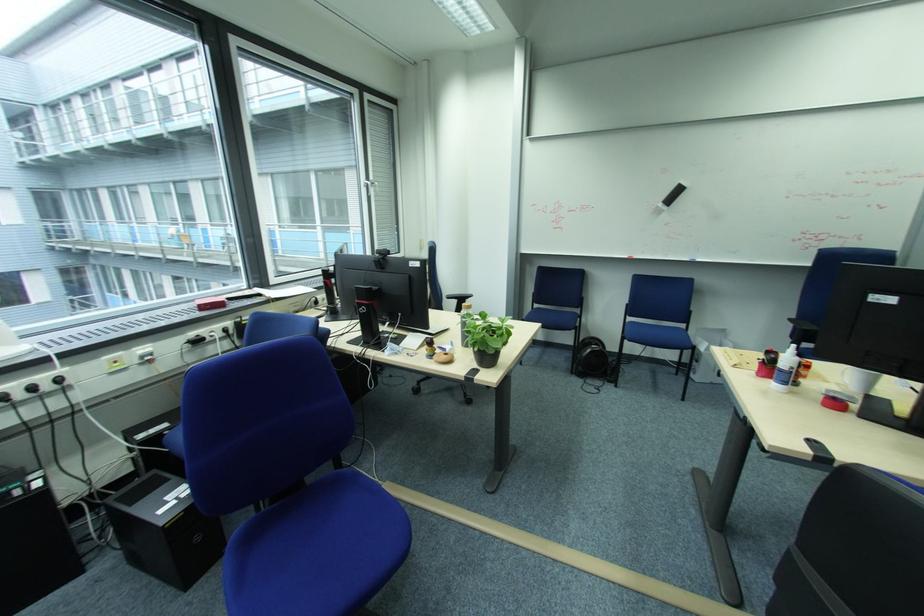
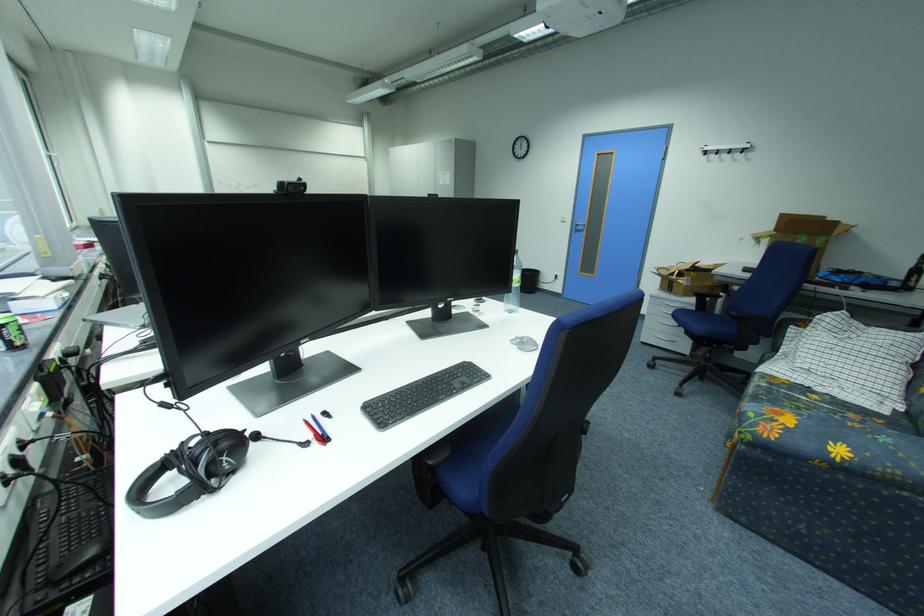
Question: I am providing you with two images of the same scene from different viewpoints. Please identify which objects are invisible in image2.

Choices:
 (A) silver door handle
 (B) clear squeeze bottle
 (C) chair sitting surface
 (D) white spray bottle

Answer: (D)